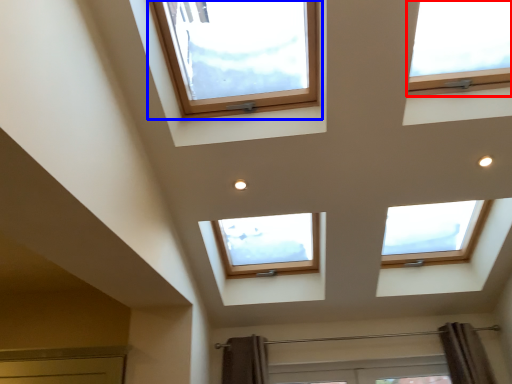
Question: Which point is further to the camera, window (highlighted by a red box) or window (highlighted by a blue box)?

Choices:
 (A) window
 (B) window

Answer: (A)